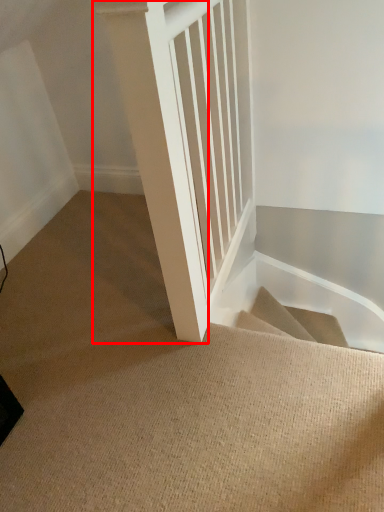
Question: Observing the image, what is the correct spatial positioning of pillar (annotated by the red box) in reference to stairs?

Choices:
 (A) left
 (B) right

Answer: (B)